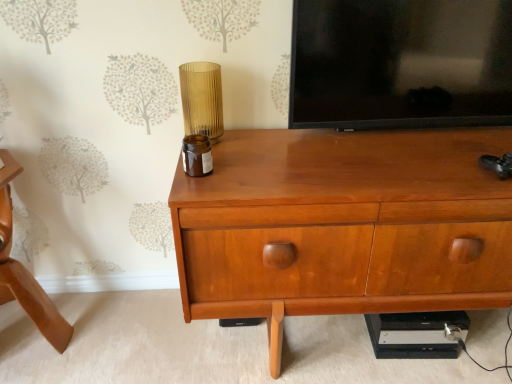
Question: Is translucent amber glass at center surrounding wooden chair at lower left?

Choices:
 (A) no
 (B) yes

Answer: (A)

Question: Does translucent amber glass at center have a greater width compared to wooden chair at lower left?

Choices:
 (A) no
 (B) yes

Answer: (A)

Question: Would you say translucent amber glass at center is outside wooden chair at lower left?

Choices:
 (A) no
 (B) yes

Answer: (B)

Question: From a real-world perspective, does translucent amber glass at center sit lower than wooden chair at lower left?

Choices:
 (A) yes
 (B) no

Answer: (B)

Question: Does translucent amber glass at center have a larger size compared to wooden chair at lower left?

Choices:
 (A) no
 (B) yes

Answer: (A)

Question: From the image's perspective, is wooden chair at lower left located above or below black glossy tv at upper center?

Choices:
 (A) below
 (B) above

Answer: (A)

Question: Do you think wooden chair at lower left is within black glossy tv at upper center, or outside of it?

Choices:
 (A) outside
 (B) inside

Answer: (A)

Question: Is wooden chair at lower left in front of or behind black glossy tv at upper center in the image?

Choices:
 (A) front
 (B) behind

Answer: (A)

Question: From their relative heights in the image, would you say wooden chair at lower left is taller or shorter than black glossy tv at upper center?

Choices:
 (A) tall
 (B) short

Answer: (A)

Question: Looking at their shapes, would you say wooden chest of drawers at center is wider or thinner than wooden chair at lower left?

Choices:
 (A) thin
 (B) wide

Answer: (B)

Question: Looking at the image, does wooden chest of drawers at center seem bigger or smaller compared to wooden chair at lower left?

Choices:
 (A) small
 (B) big

Answer: (B)

Question: From the image's perspective, relative to wooden chair at lower left, is wooden chest of drawers at center above or below?

Choices:
 (A) below
 (B) above

Answer: (B)

Question: Is wooden chest of drawers at center spatially inside wooden chair at lower left, or outside of it?

Choices:
 (A) outside
 (B) inside

Answer: (A)

Question: From a real-world perspective, is wooden chest of drawers at center positioned above or below translucent amber glass at center?

Choices:
 (A) below
 (B) above

Answer: (A)

Question: Is point (316, 236) positioned closer to the camera than point (197, 109)?

Choices:
 (A) farther
 (B) closer

Answer: (B)